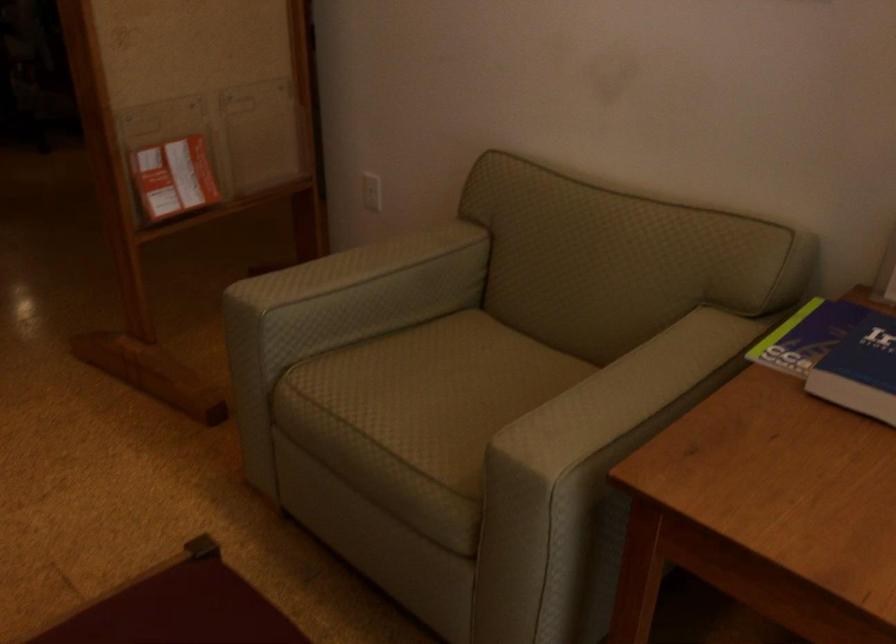
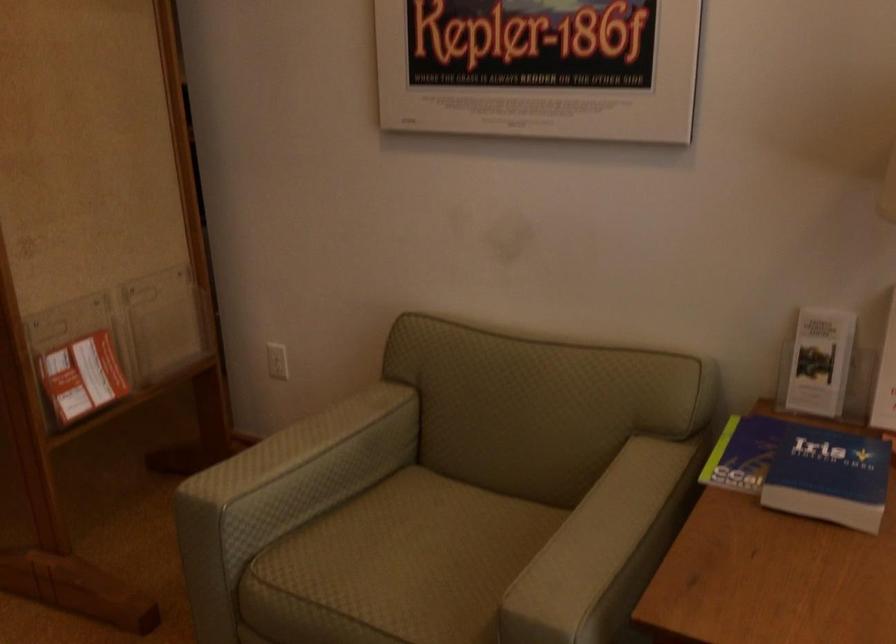
Locate, in the second image, the point that corresponds to [338,267] in the first image.

(286, 449)